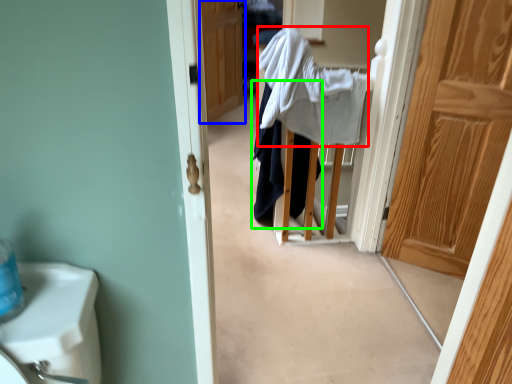
Question: Based on their relative distances, which object is nearer to bath towel (highlighted by a red box)? Choose from door (highlighted by a blue box) and clothing (highlighted by a green box).

Choices:
 (A) door
 (B) clothing

Answer: (B)